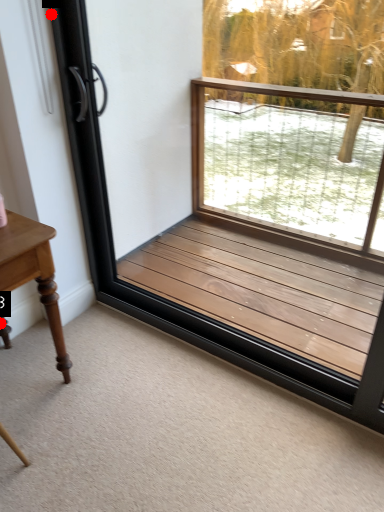
Question: Two points are circled on the image, labeled by A and B beside each circle. Among these points, which one is nearest to the camera?

Choices:
 (A) A is closer
 (B) B is closer

Answer: (A)